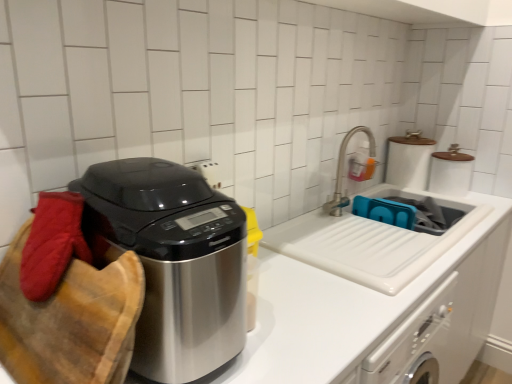
Question: Is brushed metal faucet at upper right bigger or smaller than blue plastic sink at center?

Choices:
 (A) small
 (B) big

Answer: (A)

Question: Based on their positions, is brushed metal faucet at upper right located to the left or right of blue plastic sink at center?

Choices:
 (A) right
 (B) left

Answer: (B)

Question: Which is nearer to the white glossy sink at center?

Choices:
 (A) blue plastic sink at center
 (B) brushed metal faucet at upper right
 (C) polished stainless steel appliance at left

Answer: (A)

Question: Which object is positioned farthest from the blue plastic sink at center?

Choices:
 (A) brushed metal faucet at upper right
 (B) white glossy sink at center
 (C) polished stainless steel appliance at left

Answer: (C)